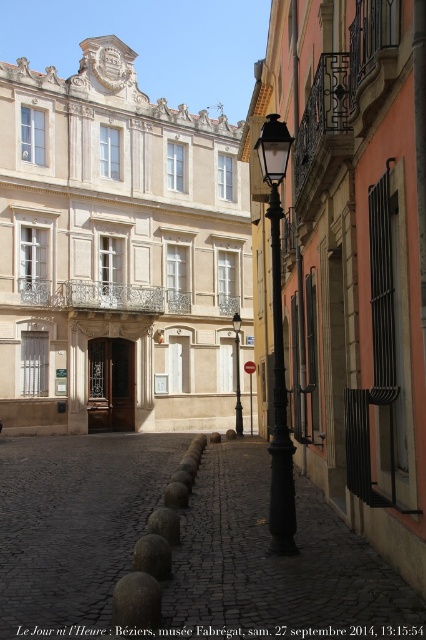
Question: Which point is farther to the camera?

Choices:
 (A) polished metal streetlamp at center
 (B) black metal lamp post at center

Answer: (B)

Question: Does polished metal streetlamp at center come behind black metal lamp post at center?

Choices:
 (A) yes
 (B) no

Answer: (B)

Question: Which of the following is the closest to the observer?

Choices:
 (A) (284, 154)
 (B) (238, 388)

Answer: (A)

Question: Does polished metal streetlamp at center appear on the left side of black metal lamp post at center?

Choices:
 (A) no
 (B) yes

Answer: (A)

Question: Does polished metal streetlamp at center have a larger size compared to black metal lamp post at center?

Choices:
 (A) no
 (B) yes

Answer: (B)